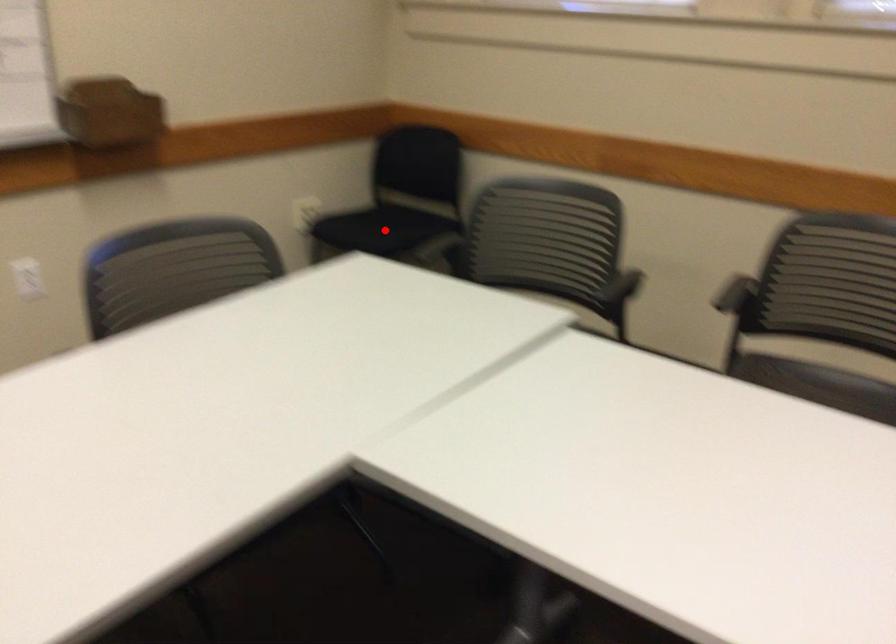
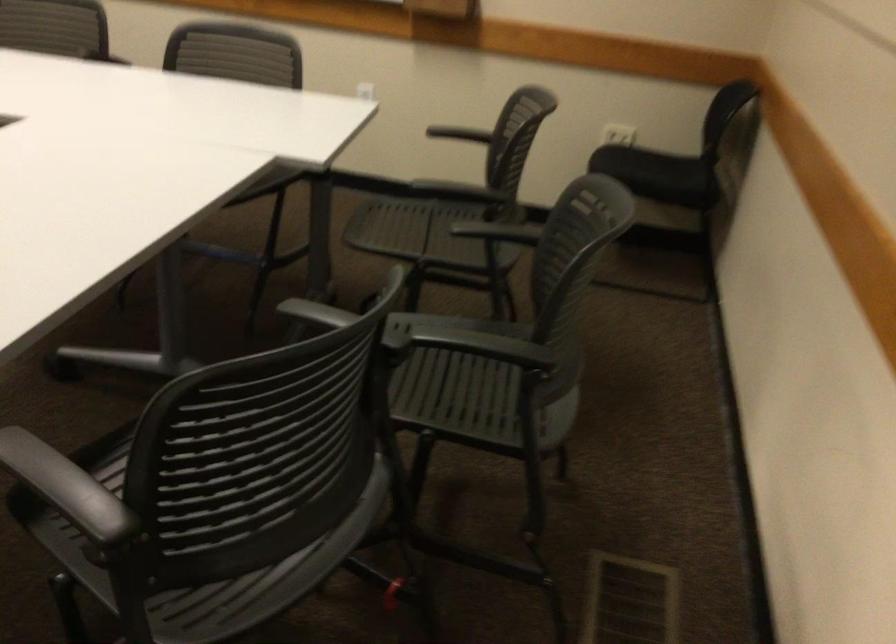
The point at the highlighted location is marked in the first image. Where is the corresponding point in the second image?

(634, 166)